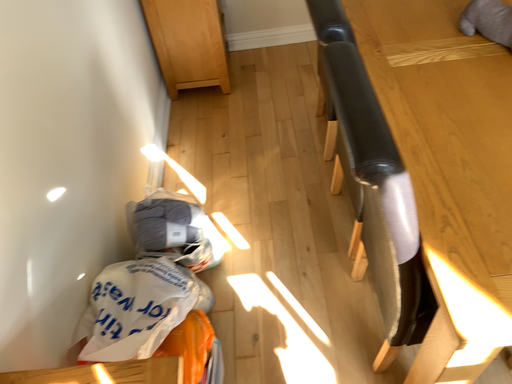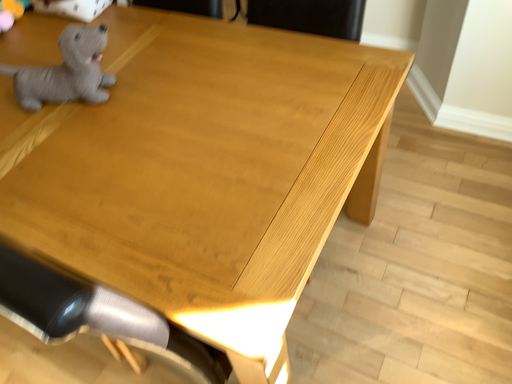
Question: Which way did the camera rotate in the video?

Choices:
 (A) rotated right
 (B) rotated left

Answer: (A)